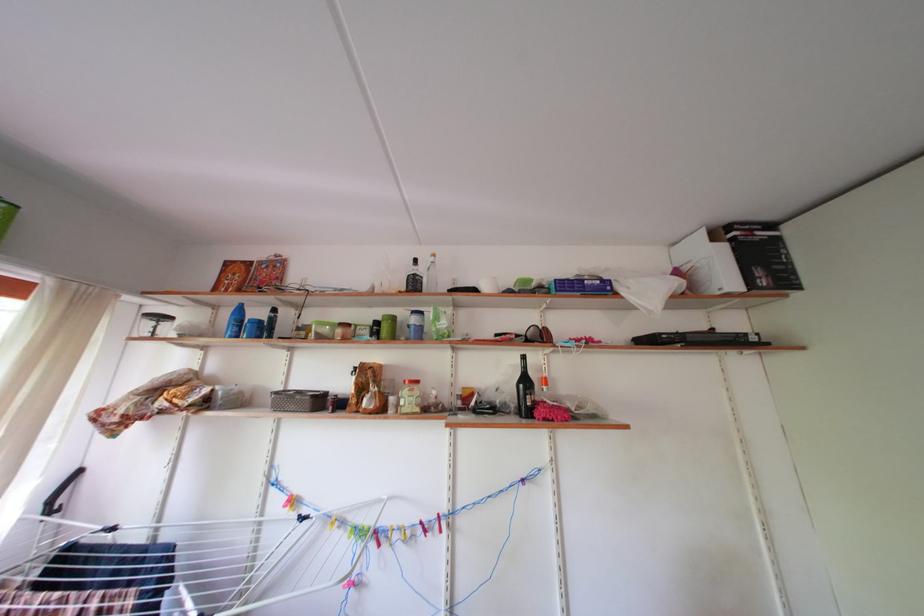
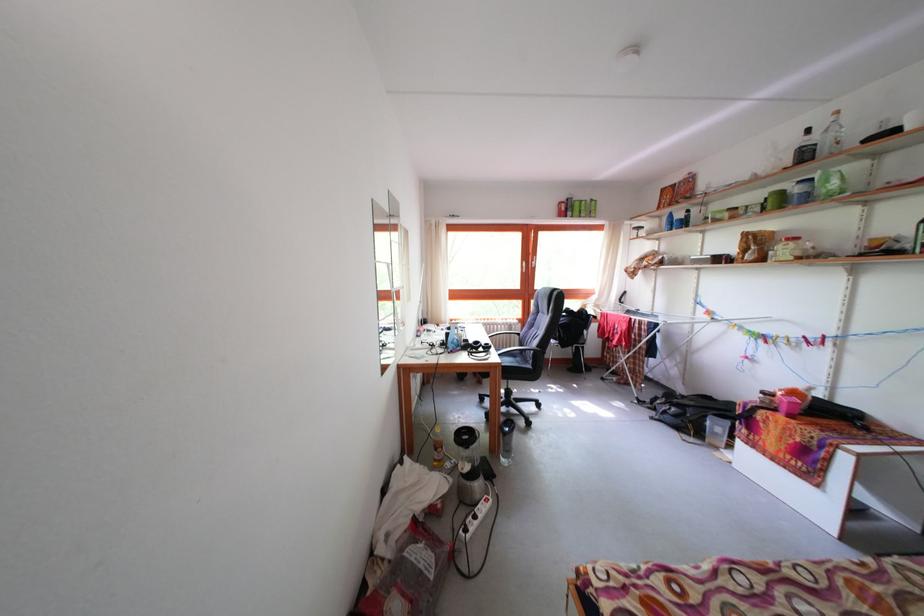
The point at (441, 265) is marked in the first image. Where is the corresponding point in the second image?

(843, 124)